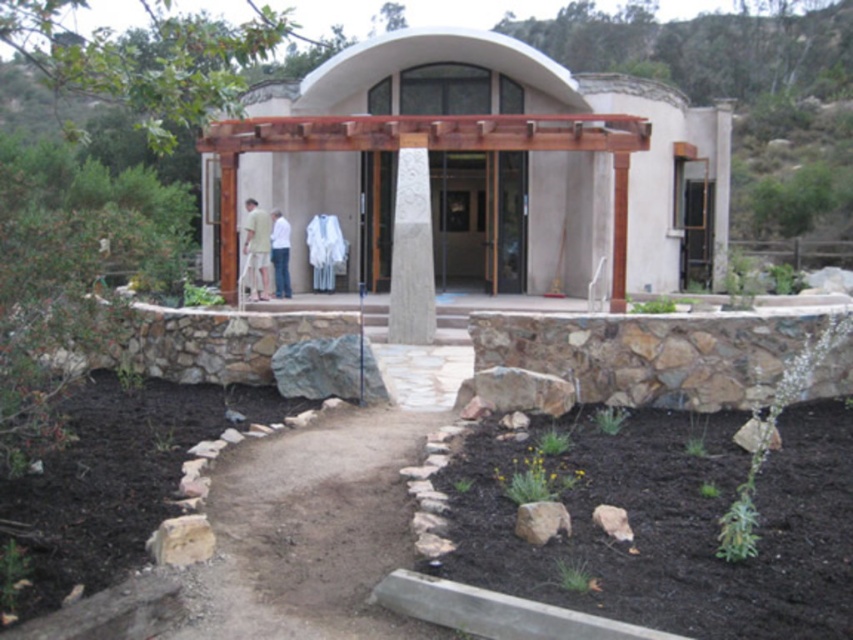
Can you confirm if light green fabric at center is shorter than gray rock at lower right?

In fact, light green fabric at center may be taller than gray rock at lower right.

Measure the distance between point (256, 236) and camera.

Point (256, 236) is 14.59 meters away from camera.

Is point (262, 241) farther from camera compared to point (610, 516)?

Yes, point (262, 241) is farther from viewer.

I want to click on light green fabric at center, so click(257, 246).

Does brown rough rock at lower center appear under gray rock at lower right?

Yes.

Is brown rough rock at lower center smaller than gray rock at lower right?

Incorrect, brown rough rock at lower center is not smaller in size than gray rock at lower right.

The image size is (853, 640). What do you see at coordinates (541, 522) in the screenshot?
I see `brown rough rock at lower center` at bounding box center [541, 522].

Identify the location of brown rough rock at lower center. The height and width of the screenshot is (640, 853). (541, 522).

Does wooden pergola at center have a lesser width compared to gray stone pillar at center?

Incorrect, wooden pergola at center's width is not less than gray stone pillar at center's.

Is wooden pergola at center to the right of gray stone pillar at center from the viewer's perspective?

Indeed, wooden pergola at center is positioned on the right side of gray stone pillar at center.

The image size is (853, 640). I want to click on wooden pergola at center, so click(x=482, y=168).